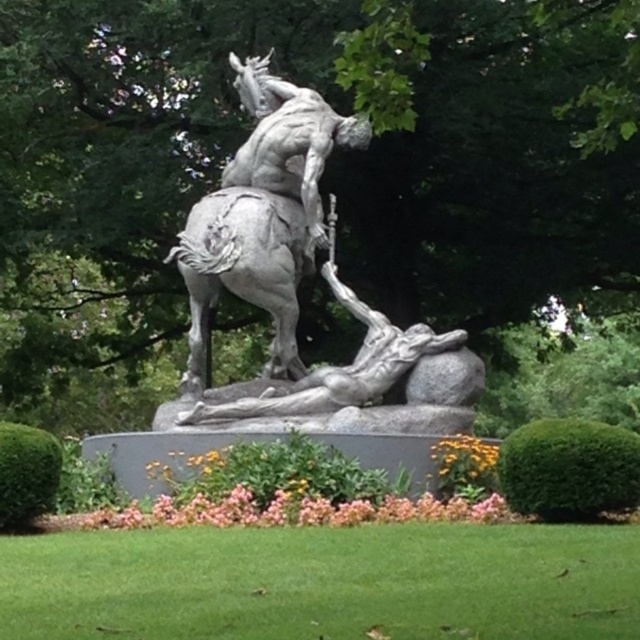
Between polished bronze statue at center and polished bronze rider at upper center, which one has less height?

polished bronze rider at upper center

Where is `polished bronze statue at center`? The width and height of the screenshot is (640, 640). polished bronze statue at center is located at coordinates (284, 262).

Locate an element on the screen. polished bronze statue at center is located at coordinates (284, 262).

Which of these two, gray stone horse at center or polished bronze rider at upper center, stands shorter?

gray stone horse at center is shorter.

Is the position of gray stone horse at center less distant than that of polished bronze rider at upper center?

Yes, gray stone horse at center is closer to the viewer.

I want to click on gray stone horse at center, so click(x=243, y=272).

Image resolution: width=640 pixels, height=640 pixels. I want to click on gray stone horse at center, so click(243, 272).

Is polished bronze statue at center positioned before gray stone horse at center?

Yes.

Does polished bronze statue at center have a smaller size compared to gray stone horse at center?

No.

Between point (243, 260) and point (204, 253), which one is positioned behind?

The point (243, 260) is more distant.

Locate an element on the screen. Image resolution: width=640 pixels, height=640 pixels. polished bronze statue at center is located at coordinates (284, 262).